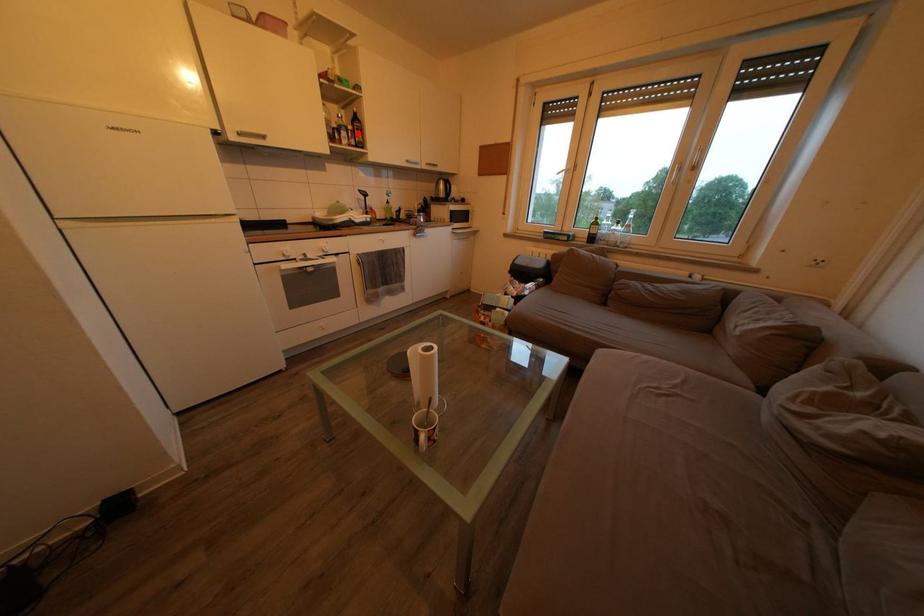
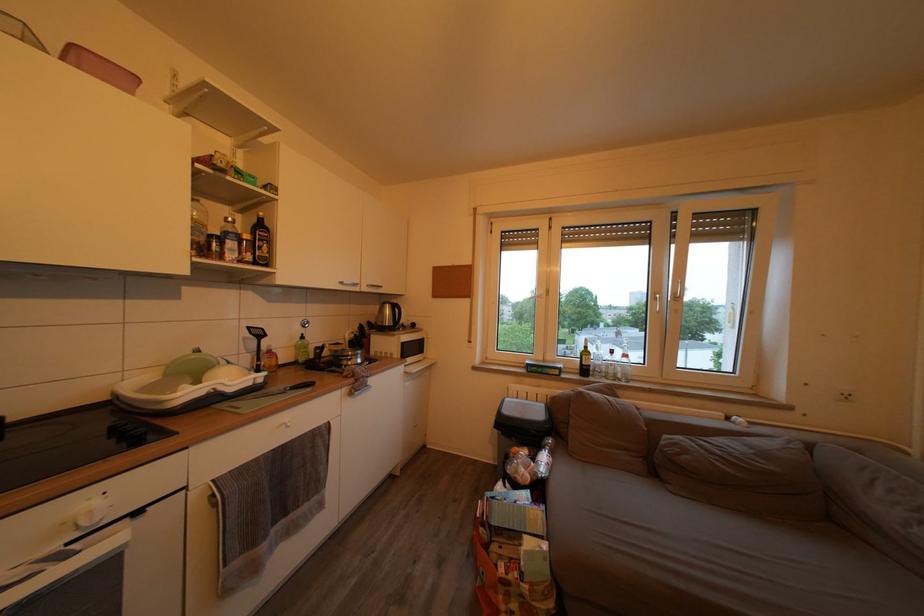
The point at the highlighted location is marked in the first image. Where is the corresponding point in the second image?

(253, 243)